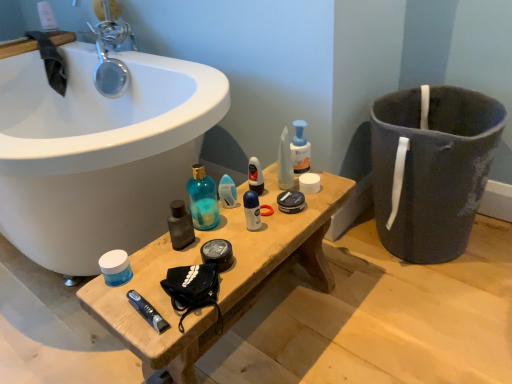
Question: From a real-world perspective, is dark gray fabric trash bin/can at right physically above translucent plastic soap dispenser at center, positioned as the 1th toiletry in right-to-left order?

Choices:
 (A) yes
 (B) no

Answer: (B)

Question: From the image's perspective, is dark gray fabric trash bin/can at right located beneath translucent plastic soap dispenser at center, positioned as the 1th toiletry in right-to-left order?

Choices:
 (A) no
 (B) yes

Answer: (B)

Question: Does dark gray fabric trash bin/can at right appear on the left side of translucent plastic soap dispenser at center, positioned as the 1th toiletry in right-to-left order?

Choices:
 (A) yes
 (B) no

Answer: (B)

Question: From a real-world perspective, is dark gray fabric trash bin/can at right positioned under translucent plastic soap dispenser at center, marked as the 3th toiletry in a left-to-right arrangement, based on gravity?

Choices:
 (A) no
 (B) yes

Answer: (B)

Question: Is dark gray fabric trash bin/can at right next to translucent plastic soap dispenser at center, marked as the 3th toiletry in a left-to-right arrangement, and touching it?

Choices:
 (A) no
 (B) yes

Answer: (A)

Question: Would you say dark gray fabric trash bin/can at right is outside translucent plastic soap dispenser at center, marked as the 3th toiletry in a left-to-right arrangement?

Choices:
 (A) no
 (B) yes

Answer: (B)

Question: Is shiny plastic mouthwash at center, acting as the second mouthwash starting from the front, behind wooden bench at center?

Choices:
 (A) yes
 (B) no

Answer: (A)

Question: Is shiny plastic mouthwash at center, which is the 2th mouthwash in top-to-bottom order, not within wooden bench at center?

Choices:
 (A) yes
 (B) no

Answer: (A)

Question: From a real-world perspective, is shiny plastic mouthwash at center, which ranks as the second mouthwash in left-to-right order, physically below wooden bench at center?

Choices:
 (A) yes
 (B) no

Answer: (B)

Question: Considering the relative sizes of shiny plastic mouthwash at center, which ranks as the second mouthwash in left-to-right order, and wooden bench at center in the image provided, is shiny plastic mouthwash at center, which ranks as the second mouthwash in left-to-right order, taller than wooden bench at center?

Choices:
 (A) yes
 (B) no

Answer: (B)

Question: Is wooden bench at center located within shiny plastic mouthwash at center, which ranks as the second mouthwash in left-to-right order?

Choices:
 (A) no
 (B) yes

Answer: (A)

Question: Can you confirm if shiny plastic mouthwash at center, which is the 2th mouthwash in top-to-bottom order, is wider than wooden bench at center?

Choices:
 (A) yes
 (B) no

Answer: (B)

Question: From a real-world perspective, is blue matte jar at center, the 3th mouthwash in the right-to-left sequence, physically above shiny plastic mouthwash at center, which is the 2th mouthwash from right to left?

Choices:
 (A) yes
 (B) no

Answer: (B)